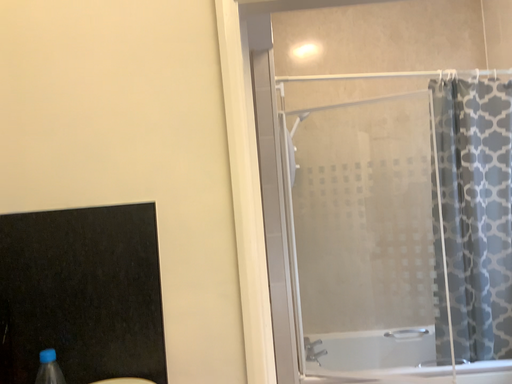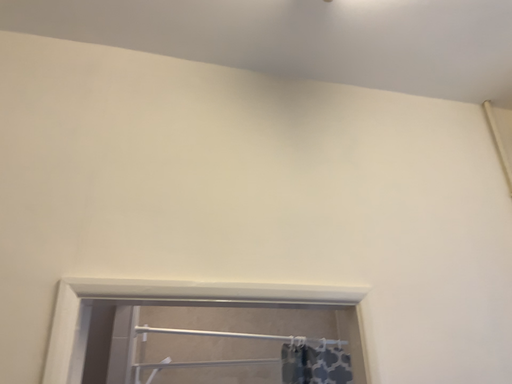
Question: Which way did the camera rotate in the video?

Choices:
 (A) rotated downward
 (B) rotated upward

Answer: (B)